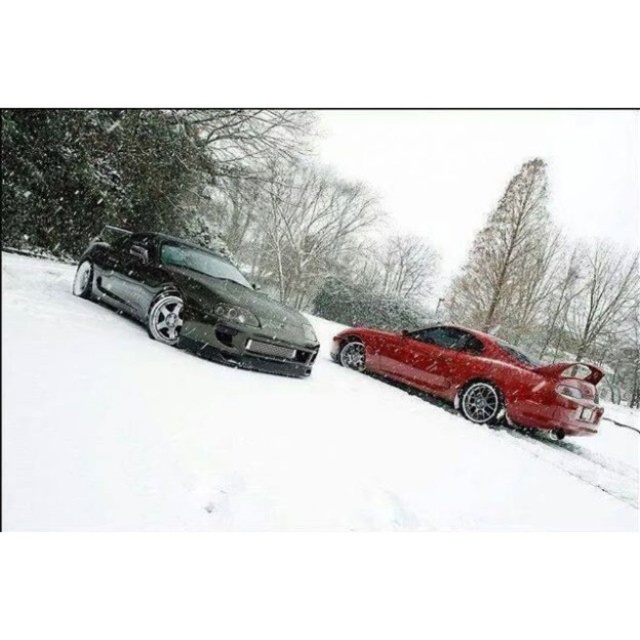
You are standing at the origin point of the coordinate system where the image is captured. There is a point marked at coordinates point (259, 440). What object is located at this point?

The point (259, 440) corresponds to the satin black car at center.

You are a delivery person trying to park your van between the satin black car at center and the glossy red car at right. The van is 2 meters wide. Can you fit your van in the space between them?

The satin black car at center might be wider than glossy red car at right, so the space between them may not be wide enough for a 2 meter wide van. Check the actual width before attempting to park.

You are a photographer wanting to capture both the satin black car at center and the shiny black car at left in a single shot. Given their positions, which car should you focus on first if you want to ensure both are in frame without moving the camera?

The satin black car at center is located below the shiny black car at left, so you should focus on the shiny black car at left first to ensure both are in frame without moving the camera.